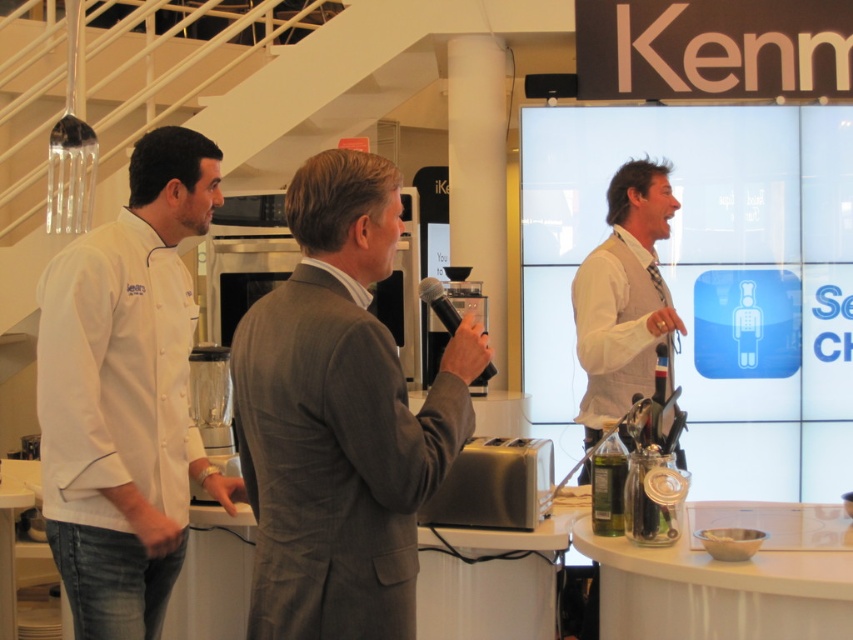
Between point (178, 483) and point (585, 268), which one is positioned behind?

The point (585, 268) is more distant.

The height and width of the screenshot is (640, 853). I want to click on white matte chef coat at left, so 126,394.

Who is more forward, (51, 388) or (627, 285)?

Point (51, 388)

This screenshot has height=640, width=853. What are the coordinates of `white matte chef coat at left` in the screenshot? It's located at (126, 394).

Between point (329, 156) and point (213, 192), which one is positioned behind?

The point (213, 192) is more distant.

Describe the element at coordinates (340, 417) in the screenshot. I see `gray wool suit at center` at that location.

Does point (230, 362) lie behind point (189, 132)?

No, (230, 362) is in front of (189, 132).

The height and width of the screenshot is (640, 853). What are the coordinates of `gray wool suit at center` in the screenshot? It's located at (340, 417).

Is point (367, 209) positioned after point (641, 300)?

That is False.

Is point (432, 408) closer to camera compared to point (653, 182)?

That is True.

This screenshot has width=853, height=640. In order to click on gray wool suit at center in this screenshot , I will do `click(340, 417)`.